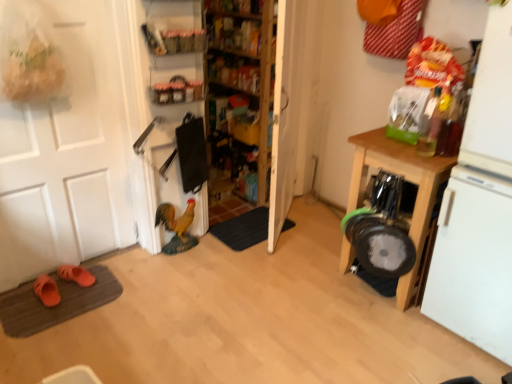
At what (x,y) coordinates should I click in order to perform the action: click on blank space to the left of orange rubber slippers at lower left, acting as the 2th footwear starting from the back. Please return your answer as a coordinate pair (x, y). The image size is (512, 384). Looking at the image, I should click on (19, 304).